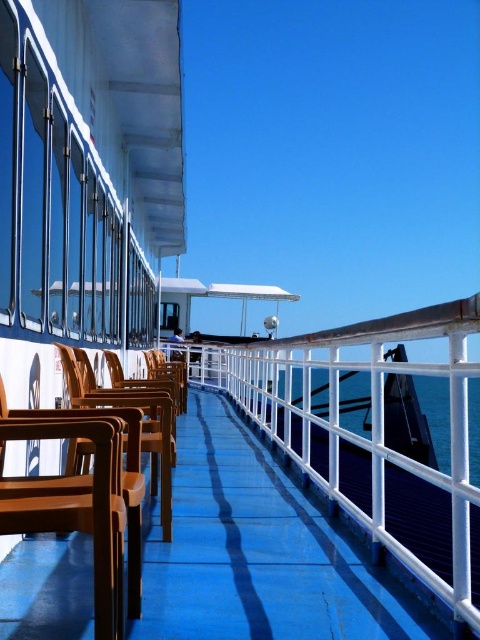
Between brown wood chairs at left and transparent blue water at center, which one appears on the left side from the viewer's perspective?

Positioned to the left is brown wood chairs at left.

Can you confirm if brown wood chairs at left is positioned below transparent blue water at center?

Actually, brown wood chairs at left is above transparent blue water at center.

What do you see at coordinates (255, 550) in the screenshot? This screenshot has width=480, height=640. I see `brown wood chairs at left` at bounding box center [255, 550].

Locate an element on the screen. brown wood chairs at left is located at coordinates (255, 550).